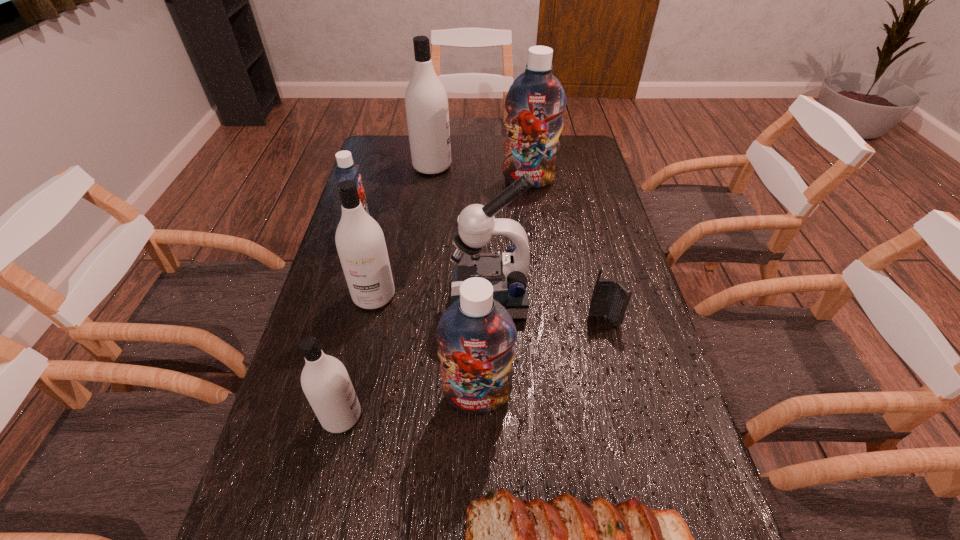
Locate an element on the screen. object that is at the far edge is located at coordinates (426, 101).

At what (x,y) coordinates should I click in order to perform the action: click on object at the right edge. Please return your answer as a coordinate pair (x, y). The height and width of the screenshot is (540, 960). Looking at the image, I should click on (609, 298).

Where is `free space at the left edge of the desktop`? free space at the left edge of the desktop is located at coordinates (331, 445).

This screenshot has width=960, height=540. I want to click on vacant space at the right edge, so click(x=640, y=394).

I want to click on vacant space at the far left corner of the desktop, so click(x=376, y=151).

You are a GUI agent. You are given a task and a screenshot of the screen. Output one action in this format:
    pyautogui.click(x=<x>, y=<y>)
    Task: Click on the vacant space in between the rightmost blue shampoo and the smallest white shampoo
    Image resolution: width=960 pixels, height=540 pixels.
    Given the screenshot: What is the action you would take?
    pyautogui.click(x=435, y=299)

The height and width of the screenshot is (540, 960). Identify the location of vacant area that lies between the rightmost shampoo and the third farthest object. (445, 205).

The image size is (960, 540). In order to click on vacant space that's between the smallest white shampoo and the microscope in this screenshot , I will do `click(416, 357)`.

Identify which object is the closest to the nearest white shampoo. Please provide its 2D coordinates. Your answer should be formatted as a tuple, i.e. [(x, y)], where the tuple contains the x and y coordinates of a point satisfying the conditions above.

[(476, 335)]

The image size is (960, 540). In order to click on the third closest object relative to the nearest blue shampoo in this screenshot , I will do `click(507, 539)`.